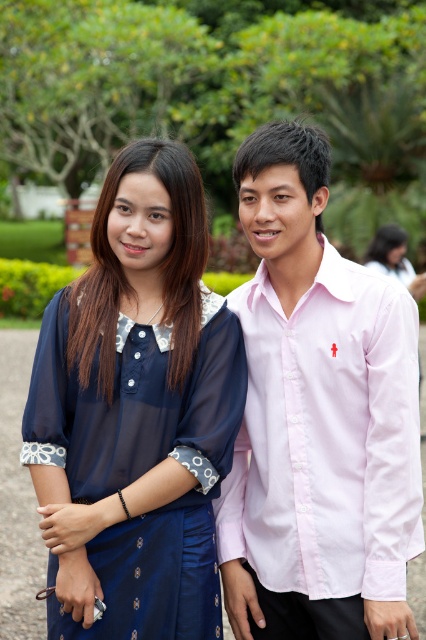
You are standing at the position of point (150, 525) and want to walk to the point (314, 209). Is the destination point behind you?

Yes, the destination point (314, 209) is behind you because it is positioned behind point (150, 525) according to the description.

You are a photographer trying to capture a clear shot of the navy sheer dress at center without the pink cotton shirt at center blocking it. Is this possible given their current positions?

The pink cotton shirt at center is positioned over the navy sheer dress at center, so it is blocking the view. To capture a clear shot of the navy sheer dress at center, you would need to adjust their positions so that the pink cotton shirt at center is no longer in front.